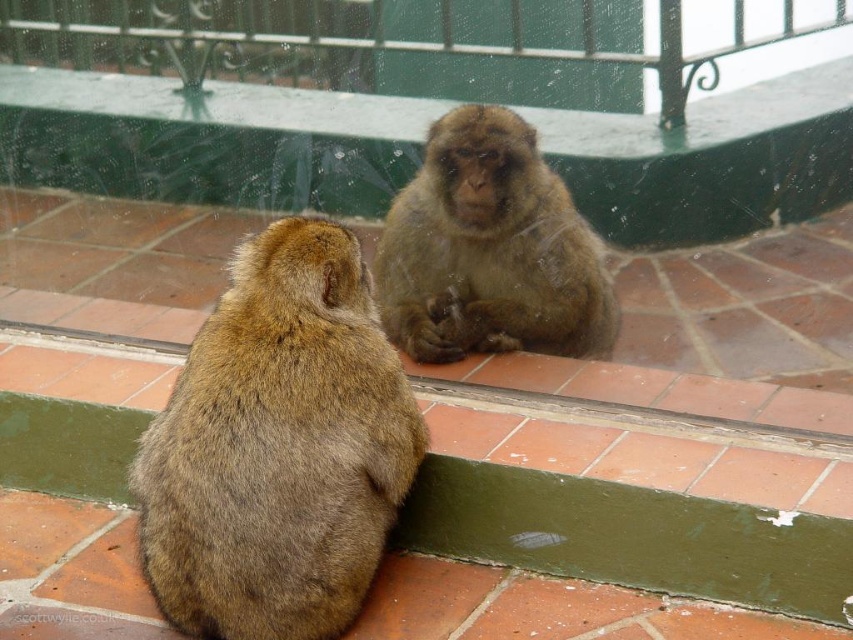
You are a zookeeper who needs to ensure the monkeys stay within the enclosure. The brown furry monkey at lower left is near the green glass rail at upper center. Which object is smaller and might require closer monitoring to prevent escape?

The brown furry monkey at lower left is smaller than the green glass rail at upper center, so it might be able to squeeze through gaps and requires closer monitoring.

You are standing at the point with coordinates point (277, 445). Which object are you currently standing on?

You are standing on the brown furry monkey at lower left because the point (277, 445) is located on it.

You are a zookeeper observing the monkeys in their enclosure. You notice two monkeys, the brown furry monkey at lower left and the brown furry monkey at center. From your vantage point, which monkey is positioned to the left of the other?

The brown furry monkey at lower left is positioned to the left of the brown furry monkey at center.